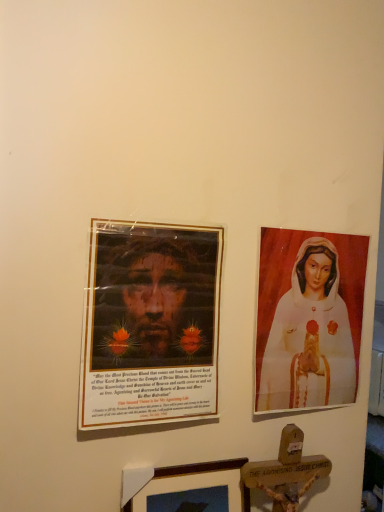
Question: Is point (317, 318) positioned closer to the camera than point (122, 474)?

Choices:
 (A) closer
 (B) farther

Answer: (B)

Question: In the image, is white glossy statue at right positioned in front of or behind wooden picture frame at lower center?

Choices:
 (A) front
 (B) behind

Answer: (B)

Question: From the image's perspective, is white glossy statue at right positioned above or below wooden picture frame at lower center?

Choices:
 (A) above
 (B) below

Answer: (A)

Question: Considering their positions, is wooden picture frame at lower center located in front of or behind white glossy statue at right?

Choices:
 (A) front
 (B) behind

Answer: (A)

Question: From a real-world perspective, is wooden picture frame at lower center positioned above or below white glossy statue at right?

Choices:
 (A) above
 (B) below

Answer: (B)

Question: Considering the positions of wooden picture frame at lower center and white glossy statue at right in the image, is wooden picture frame at lower center wider or thinner than white glossy statue at right?

Choices:
 (A) wide
 (B) thin

Answer: (A)

Question: From the image's perspective, relative to white glossy statue at right, is wooden picture frame at lower center above or below?

Choices:
 (A) above
 (B) below

Answer: (B)